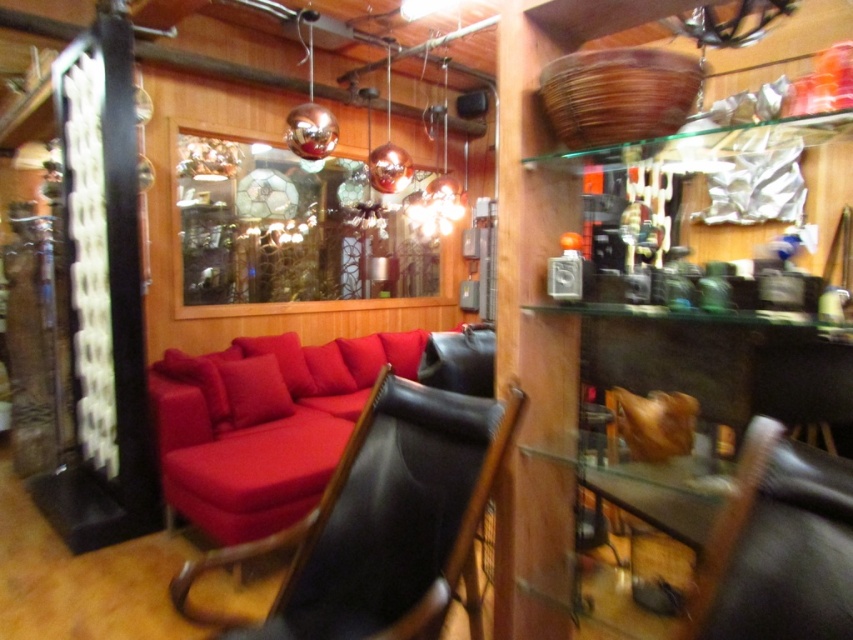
Who is shorter, matte red couch at center or black leather chair at center?

Standing shorter between the two is black leather chair at center.

Can you confirm if matte red couch at center is positioned above black leather chair at center?

No.

Who is more distant from viewer, (405, 364) or (837, 476)?

The point (405, 364) is behind.

Locate an element on the screen. The height and width of the screenshot is (640, 853). matte red couch at center is located at coordinates (283, 419).